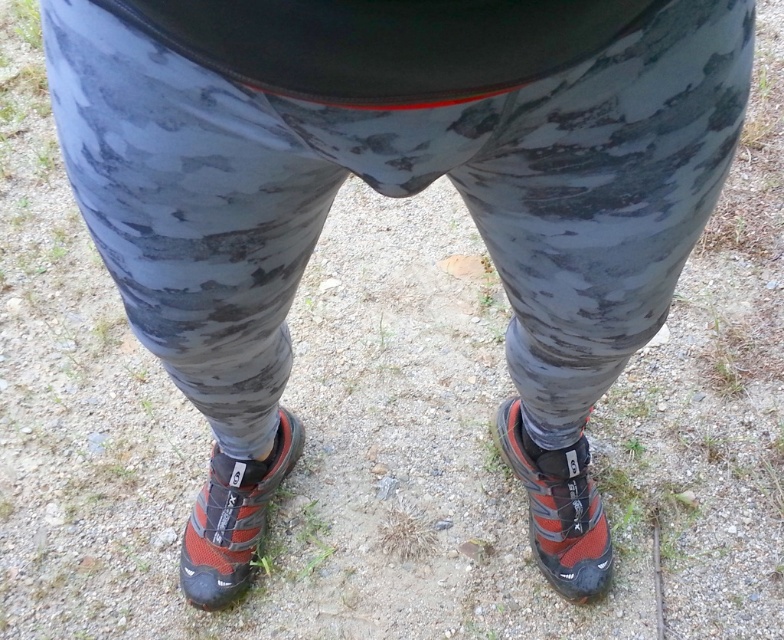
Question: Can you confirm if red mesh shoe at lower right is bigger than black mesh sock at lower center?

Choices:
 (A) yes
 (B) no

Answer: (A)

Question: Which of these objects is positioned closest to the red mesh shoe at lower right?

Choices:
 (A) black mesh sock at lower center
 (B) matte orange shoe at lower center

Answer: (B)

Question: Which object is the farthest from the matte orange shoe at lower center?

Choices:
 (A) red mesh shoe at lower right
 (B) black mesh sock at lower center

Answer: (A)

Question: Among these points, which one is farthest from the camera?

Choices:
 (A) (191, 522)
 (B) (561, 513)
 (C) (240, 428)

Answer: (A)

Question: Where is red mesh shoe at lower right located in relation to black mesh sock at lower center in the image?

Choices:
 (A) above
 (B) below

Answer: (B)

Question: Does red mesh shoe at lower right lie behind black mesh sock at lower center?

Choices:
 (A) no
 (B) yes

Answer: (B)